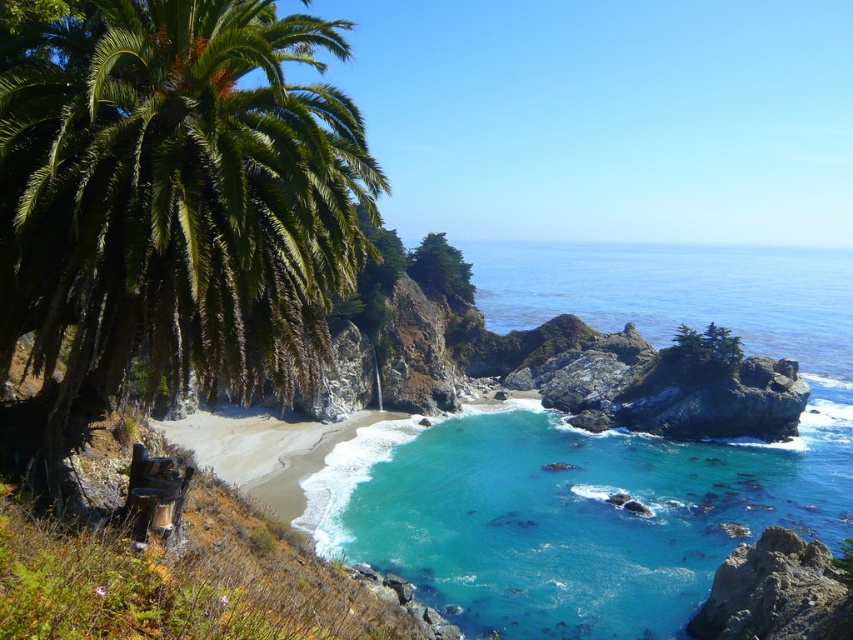
Who is more forward, (113, 209) or (813, 376)?

Point (113, 209) is more forward.

Is the position of green leafy palm tree at left less distant than that of clear blue water at center?

Yes, it is in front of clear blue water at center.

Identify the location of green leafy palm tree at left. (172, 205).

Is turquoise glossy water at center positioned in front of clear blue water at center?

Yes, turquoise glossy water at center is closer to the viewer.

Does turquoise glossy water at center have a lesser height compared to clear blue water at center?

Yes, turquoise glossy water at center is shorter than clear blue water at center.

Find the location of a particular element. The height and width of the screenshot is (640, 853). turquoise glossy water at center is located at coordinates (575, 513).

Is green leafy palm tree at left above turquoise glossy water at center?

Correct, green leafy palm tree at left is located above turquoise glossy water at center.

Is green leafy palm tree at left positioned in front of turquoise glossy water at center?

Yes, green leafy palm tree at left is in front of turquoise glossy water at center.

Does point (363, 176) lie in front of point (467, 628)?

Yes, point (363, 176) is closer to viewer.

This screenshot has width=853, height=640. I want to click on green leafy palm tree at left, so pos(172,205).